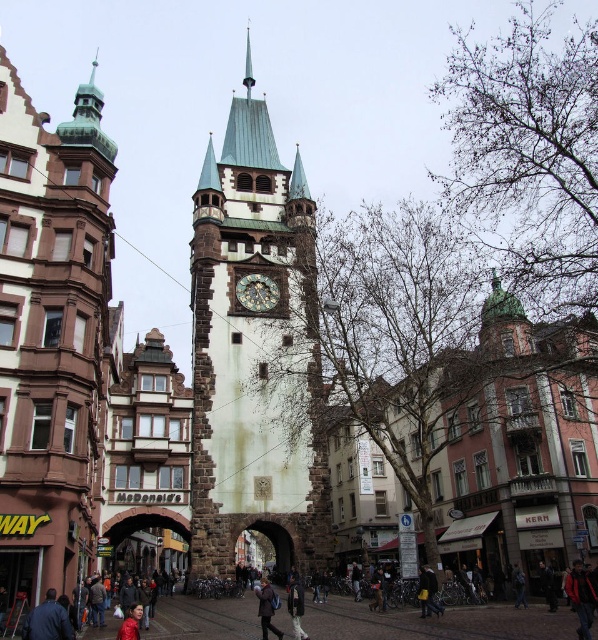
Based on the photo, which is above, stone clock tower at center or dark blue coat at center?

stone clock tower at center

Is point (291, 256) positioned before point (264, 636)?

No.

Identify the location of stone clock tower at center. (255, 355).

Does point (437, 620) lie behind point (257, 300)?

No, it is not.

The image size is (598, 640). Find the location of `dark blue coat at lower center`. dark blue coat at lower center is located at coordinates (435, 621).

Describe the element at coordinates (255, 355) in the screenshot. I see `stone clock tower at center` at that location.

Between point (230, 326) and point (251, 289), which one is positioned behind?

Point (251, 289)

This screenshot has height=640, width=598. Find the location of `stone clock tower at center`. stone clock tower at center is located at coordinates (255, 355).